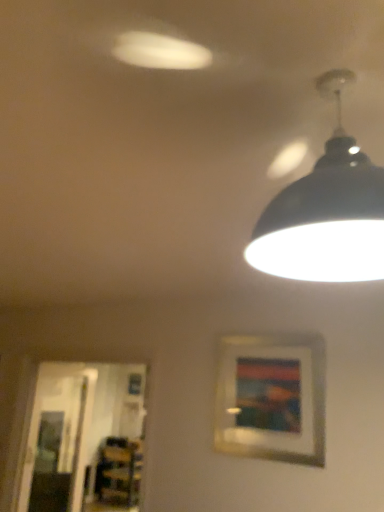
Question: Is wooden picture frame at center further to the viewer compared to transparent glass door at lower left, arranged as the 1th glass door when viewed from the right?

Choices:
 (A) no
 (B) yes

Answer: (A)

Question: Can transparent glass door at lower left, the 2th glass door in the left-to-right sequence, be found inside wooden picture frame at center?

Choices:
 (A) no
 (B) yes

Answer: (A)

Question: From the image's perspective, is wooden picture frame at center on transparent glass door at lower left, the 2th glass door in the left-to-right sequence?

Choices:
 (A) no
 (B) yes

Answer: (B)

Question: Does wooden picture frame at center appear on the left side of transparent glass door at lower left, arranged as the 1th glass door when viewed from the right?

Choices:
 (A) yes
 (B) no

Answer: (B)

Question: Is wooden picture frame at center positioned beyond the bounds of transparent glass door at lower left, arranged as the 1th glass door when viewed from the right?

Choices:
 (A) no
 (B) yes

Answer: (B)

Question: Considering the relative sizes of wooden picture frame at center and transparent glass door at lower left, placed as the 1th glass door when sorted from front to back, in the image provided, is wooden picture frame at center taller than transparent glass door at lower left, placed as the 1th glass door when sorted from front to back,?

Choices:
 (A) no
 (B) yes

Answer: (A)

Question: Considering the relative positions of transparent glass door at left, arranged as the 2th glass door when viewed from the right, and wooden picture frame at center in the image provided, is transparent glass door at left, arranged as the 2th glass door when viewed from the right, to the left of wooden picture frame at center from the viewer's perspective?

Choices:
 (A) yes
 (B) no

Answer: (A)

Question: Is transparent glass door at left, which appears as the 1th glass door when viewed from the back, in contact with wooden picture frame at center?

Choices:
 (A) yes
 (B) no

Answer: (B)

Question: Does transparent glass door at left, arranged as the 2th glass door when viewed from the right, come in front of wooden picture frame at center?

Choices:
 (A) no
 (B) yes

Answer: (A)

Question: Can you confirm if transparent glass door at left, arranged as the 2th glass door when viewed from the right, is bigger than wooden picture frame at center?

Choices:
 (A) no
 (B) yes

Answer: (B)

Question: Is transparent glass door at left, the second glass door in the front-to-back sequence, smaller than wooden picture frame at center?

Choices:
 (A) no
 (B) yes

Answer: (A)

Question: From a real-world perspective, is transparent glass door at left, which appears as the 1th glass door when viewed from the back, physically above wooden picture frame at center?

Choices:
 (A) no
 (B) yes

Answer: (A)

Question: Is wooden bookshelf at lower left shorter than transparent glass door at lower left, the 2th glass door in the left-to-right sequence?

Choices:
 (A) no
 (B) yes

Answer: (B)